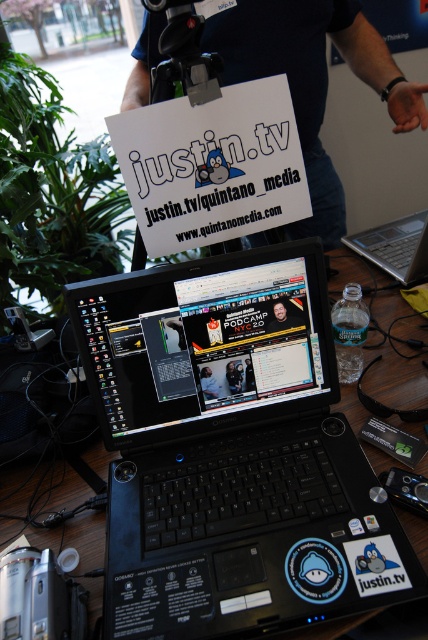
Does black plastic laptop at center appear over blue shirt at upper center?

Incorrect, black plastic laptop at center is not positioned above blue shirt at upper center.

Does point (202, 516) come farther from viewer compared to point (359, 40)?

That is False.

Where is `black plastic laptop at center`? black plastic laptop at center is located at coordinates (231, 452).

Does point (110, 129) come closer to viewer compared to point (18, 577)?

No, it is not.

Between point (163, 100) and point (3, 593), which one is positioned in front?

Point (3, 593) is in front.

Who is more forward, (207, 132) or (73, 588)?

Point (73, 588)

This screenshot has width=428, height=640. In order to click on white paper sign at center in this screenshot , I will do `click(211, 164)`.

Is blue shirt at upper center above silver metallic laptop at center?

Correct, blue shirt at upper center is located above silver metallic laptop at center.

Is blue shirt at upper center positioned at the back of silver metallic laptop at center?

That is False.

The width and height of the screenshot is (428, 640). I want to click on blue shirt at upper center, so click(312, 81).

Locate an element on the screen. blue shirt at upper center is located at coordinates (312, 81).